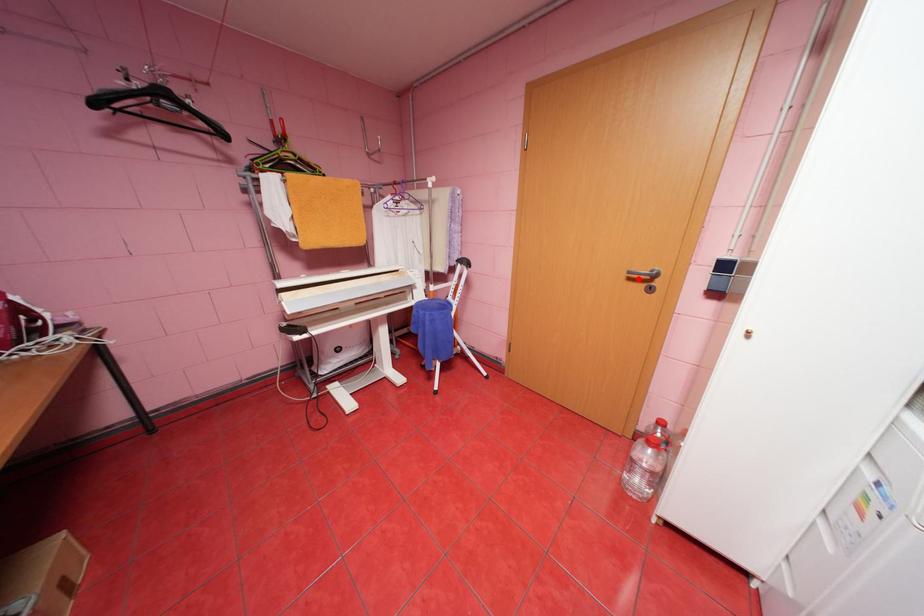
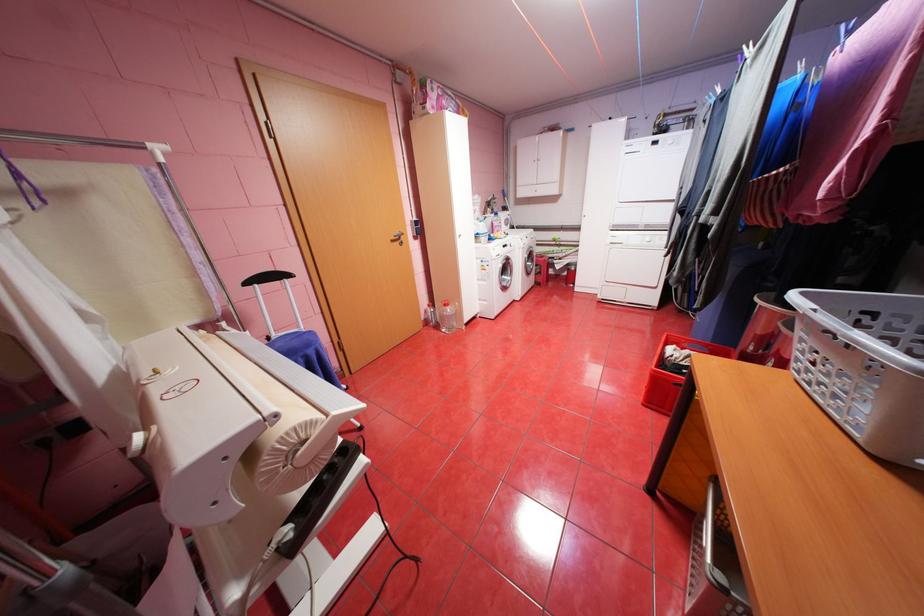
Find the pixel in the second image that matches the highlighted location in the first image.

(400, 241)